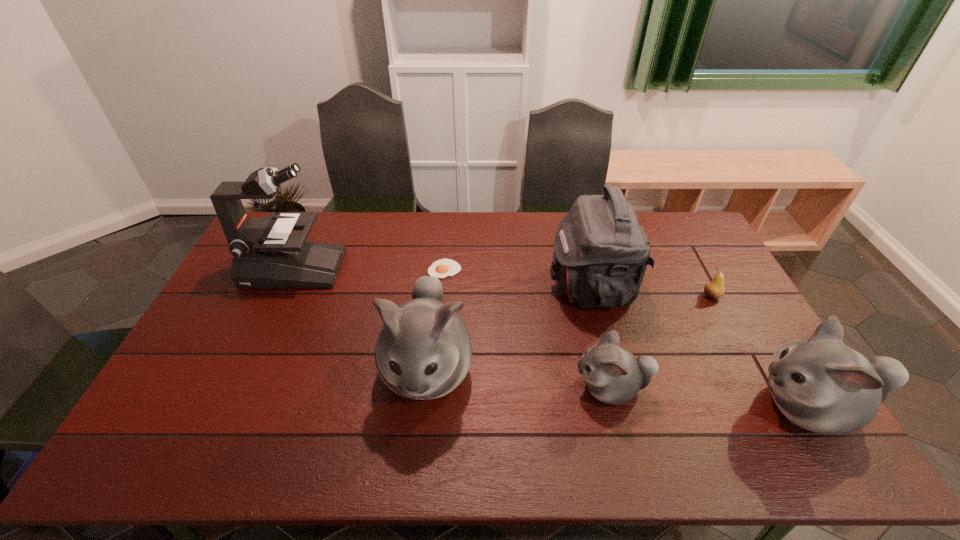
The hamsters are evenly distributed in the image. To maintain this, where would you place another hamster on the left? Please point to a free space. Please provide its 2D coordinates. Your answer should be formatted as a tuple, i.e. [(x, y)], where the tuple contains the x and y coordinates of a point satisfying the conditions above.

[(255, 354)]